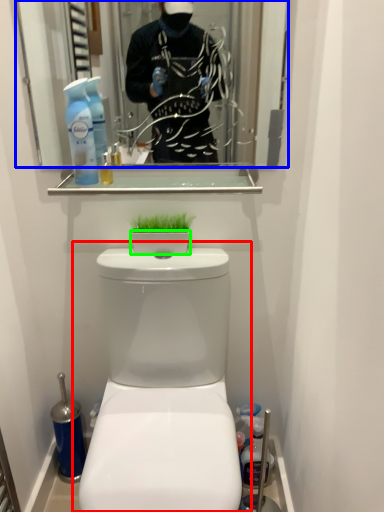
Question: Considering the real-world distances, which object is closest to toilet (highlighted by a red box)? mirror (highlighted by a blue box) or toilet bowl (highlighted by a green box).

Choices:
 (A) mirror
 (B) toilet bowl

Answer: (B)